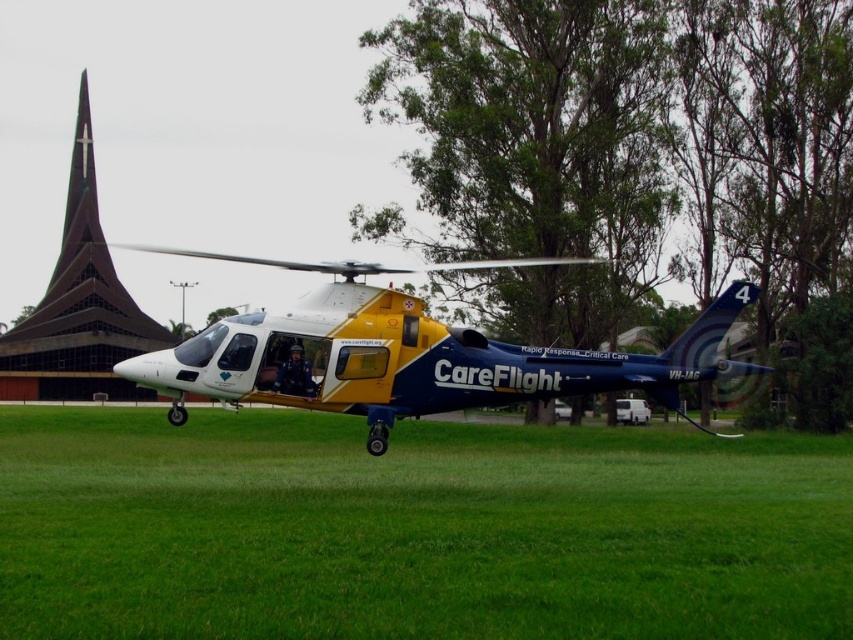
You are a drone operator trying to capture aerial footage of the yellow matte careflight helicopter at center and the dark brown glass spire at upper left. From your current position above the scene, which object is positioned lower in the frame?

The yellow matte careflight helicopter at center is positioned lower in the frame than the dark brown glass spire at upper left.